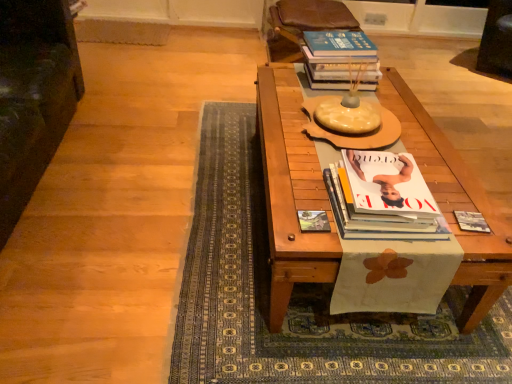
Question: From a real-world perspective, is white glossy magazine at center, acting as the 2th book starting from the top, located beneath brown leather armchair at upper center, the 2th armchair when ordered from left to right?

Choices:
 (A) yes
 (B) no

Answer: (B)

Question: Considering the relative sizes of white glossy magazine at center, the third book from the back, and brown leather armchair at upper center, which is counted as the 2th armchair, starting from the front, in the image provided, is white glossy magazine at center, the third book from the back, smaller than brown leather armchair at upper center, which is counted as the 2th armchair, starting from the front,?

Choices:
 (A) no
 (B) yes

Answer: (B)

Question: Does white glossy magazine at center, the third book from the back, lie behind brown leather armchair at upper center, which is the first armchair in back-to-front order?

Choices:
 (A) no
 (B) yes

Answer: (A)

Question: Can you confirm if white glossy magazine at center, which is counted as the 2th book, starting from the bottom, is shorter than brown leather armchair at upper center, which is the first armchair in right-to-left order?

Choices:
 (A) yes
 (B) no

Answer: (A)

Question: Are white glossy magazine at center, which is counted as the 2th book, starting from the bottom, and brown leather armchair at upper center, which is the first armchair in right-to-left order, located far from each other?

Choices:
 (A) no
 (B) yes

Answer: (B)

Question: Is point (49, 100) closer or farther from the camera than point (488, 231)?

Choices:
 (A) closer
 (B) farther

Answer: (B)

Question: From their relative heights in the image, would you say dark green fabric armchair at left, marked as the second armchair in a back-to-front arrangement, is taller or shorter than matte black book at right, which is the 1th book in bottom-to-top order?

Choices:
 (A) tall
 (B) short

Answer: (A)

Question: From a real-world perspective, is dark green fabric armchair at left, placed as the first armchair when sorted from front to back, physically located above or below matte black book at right, the 2th book when ordered from back to front?

Choices:
 (A) above
 (B) below

Answer: (B)

Question: Would you say dark green fabric armchair at left, placed as the first armchair when sorted from front to back, is inside or outside matte black book at right, the 2th book when ordered from back to front?

Choices:
 (A) outside
 (B) inside

Answer: (A)

Question: Is point (424, 233) closer or farther from the camera than point (317, 220)?

Choices:
 (A) farther
 (B) closer

Answer: (B)

Question: In terms of width, does white glossy magazine at center, the third book from the back, look wider or thinner when compared to matte paper book cover at center?

Choices:
 (A) thin
 (B) wide

Answer: (B)

Question: Is white glossy magazine at center, the third book from the back, spatially inside matte paper book cover at center, or outside of it?

Choices:
 (A) outside
 (B) inside

Answer: (A)

Question: From the image's perspective, relative to matte paper book cover at center, is white glossy magazine at center, which is counted as the 2th book, starting from the bottom, above or below?

Choices:
 (A) above
 (B) below

Answer: (A)

Question: From a real-world perspective, is brown leather armchair at upper center, which is the first armchair in back-to-front order, positioned above or below white glossy magazine at center, the third book from the back?

Choices:
 (A) below
 (B) above

Answer: (A)

Question: In terms of height, does brown leather armchair at upper center, which is the first armchair in right-to-left order, look taller or shorter compared to white glossy magazine at center, the first book in the front-to-back sequence?

Choices:
 (A) tall
 (B) short

Answer: (A)